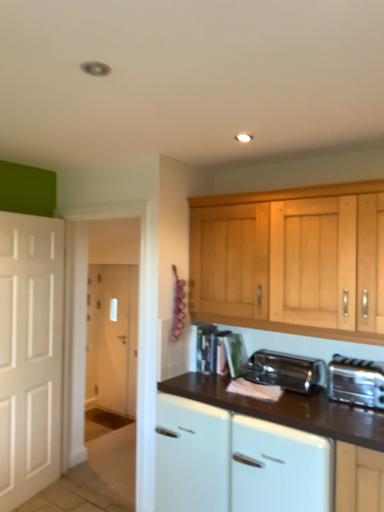
Question: Is white glossy cabinet at center far away from satin chrome toaster at lower center?

Choices:
 (A) no
 (B) yes

Answer: (A)

Question: Is white glossy cabinet at center bigger than satin chrome toaster at lower center?

Choices:
 (A) yes
 (B) no

Answer: (A)

Question: Can you confirm if white glossy cabinet at center is smaller than satin chrome toaster at lower center?

Choices:
 (A) no
 (B) yes

Answer: (A)

Question: Are white glossy cabinet at center and satin chrome toaster at lower center beside each other?

Choices:
 (A) yes
 (B) no

Answer: (B)

Question: Considering the relative positions of white glossy cabinet at center and satin chrome toaster at lower center in the image provided, is white glossy cabinet at center in front of satin chrome toaster at lower center?

Choices:
 (A) yes
 (B) no

Answer: (A)

Question: Is point (339, 392) positioned closer to the camera than point (264, 353)?

Choices:
 (A) closer
 (B) farther

Answer: (A)

Question: Is silver metallic toaster at lower right to the left or to the right of satin chrome toaster at lower center in the image?

Choices:
 (A) right
 (B) left

Answer: (A)

Question: From a real-world perspective, is silver metallic toaster at lower right above or below satin chrome toaster at lower center?

Choices:
 (A) above
 (B) below

Answer: (A)

Question: Is silver metallic toaster at lower right bigger or smaller than satin chrome toaster at lower center?

Choices:
 (A) big
 (B) small

Answer: (B)

Question: From a real-world perspective, is satin chrome toaster at lower center above or below white glossy dishwasher at lower center?

Choices:
 (A) below
 (B) above

Answer: (B)

Question: In terms of height, does satin chrome toaster at lower center look taller or shorter compared to white glossy dishwasher at lower center?

Choices:
 (A) tall
 (B) short

Answer: (B)

Question: In the image, is satin chrome toaster at lower center on the left side or the right side of white glossy dishwasher at lower center?

Choices:
 (A) right
 (B) left

Answer: (B)

Question: Would you say satin chrome toaster at lower center is inside or outside white glossy dishwasher at lower center?

Choices:
 (A) outside
 (B) inside

Answer: (A)

Question: Considering the positions of satin chrome toaster at lower center and silver metallic toaster at lower right in the image, is satin chrome toaster at lower center taller or shorter than silver metallic toaster at lower right?

Choices:
 (A) tall
 (B) short

Answer: (B)

Question: From a real-world perspective, is satin chrome toaster at lower center positioned above or below silver metallic toaster at lower right?

Choices:
 (A) above
 (B) below

Answer: (B)